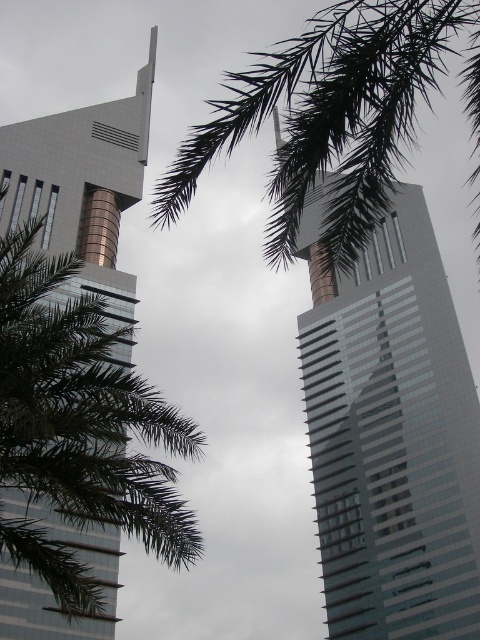
Is point (444, 486) positioned behind point (304, 65)?

Yes.

Can you confirm if glassy reflective skyscraper at center is shorter than green leafy palm at upper center?

Indeed, glassy reflective skyscraper at center has a lesser height compared to green leafy palm at upper center.

Which is behind, point (386, 410) or point (299, 124)?

The point (386, 410) is more distant.

You are a GUI agent. You are given a task and a screenshot of the screen. Output one action in this format:
    pyautogui.click(x=<x>, y=<y>)
    Task: Click on the glassy reflective skyscraper at center
    This screenshot has height=640, width=480.
    Given the screenshot: What is the action you would take?
    pyautogui.click(x=391, y=435)

Can you confirm if glassy reflective skyscraper at center is shorter than metallic glass skyscraper at left?

Indeed, glassy reflective skyscraper at center has a lesser height compared to metallic glass skyscraper at left.

Describe the element at coordinates (391, 435) in the screenshot. I see `glassy reflective skyscraper at center` at that location.

This screenshot has width=480, height=640. I want to click on glassy reflective skyscraper at center, so click(391, 435).

Who is positioned more to the right, green leafy palm at upper center or metallic glass skyscraper at left?

green leafy palm at upper center

Consider the image. Measure the distance between green leafy palm at upper center and camera.

green leafy palm at upper center is 60.78 feet from camera.

Find the location of a particular element. This screenshot has width=480, height=640. green leafy palm at upper center is located at coordinates (335, 115).